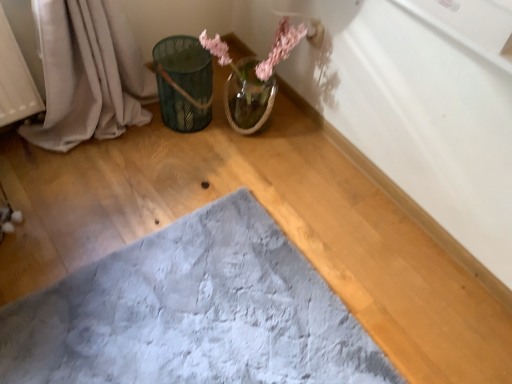
Question: Is soft gray plush bath mat at center oriented away from green metallic bucket at upper left?

Choices:
 (A) yes
 (B) no

Answer: (B)

Question: Is soft gray plush bath mat at center further to the viewer compared to green metallic bucket at upper left?

Choices:
 (A) no
 (B) yes

Answer: (A)

Question: Is soft gray plush bath mat at center to the left of green metallic bucket at upper left from the viewer's perspective?

Choices:
 (A) no
 (B) yes

Answer: (A)

Question: Is the surface of soft gray plush bath mat at center in direct contact with green metallic bucket at upper left?

Choices:
 (A) no
 (B) yes

Answer: (A)

Question: Considering the relative sizes of soft gray plush bath mat at center and green metallic bucket at upper left in the image provided, is soft gray plush bath mat at center smaller than green metallic bucket at upper left?

Choices:
 (A) no
 (B) yes

Answer: (A)

Question: Can you confirm if soft gray plush bath mat at center is taller than green metallic bucket at upper left?

Choices:
 (A) no
 (B) yes

Answer: (A)

Question: Is green metallic bucket at upper left oriented away from soft gray plush bath mat at center?

Choices:
 (A) no
 (B) yes

Answer: (A)

Question: Is soft gray plush bath mat at center located within green metallic bucket at upper left?

Choices:
 (A) yes
 (B) no

Answer: (B)

Question: Is green metallic bucket at upper left positioned beyond the bounds of soft gray plush bath mat at center?

Choices:
 (A) no
 (B) yes

Answer: (B)

Question: Can you confirm if green metallic bucket at upper left is taller than soft gray plush bath mat at center?

Choices:
 (A) no
 (B) yes

Answer: (B)

Question: Is green metallic bucket at upper left shorter than soft gray plush bath mat at center?

Choices:
 (A) no
 (B) yes

Answer: (A)

Question: From a real-world perspective, is green metallic bucket at upper left located beneath soft gray plush bath mat at center?

Choices:
 (A) yes
 (B) no

Answer: (B)

Question: From the image's perspective, is soft gray plush bath mat at center under translucent glass vase at upper center?

Choices:
 (A) yes
 (B) no

Answer: (A)